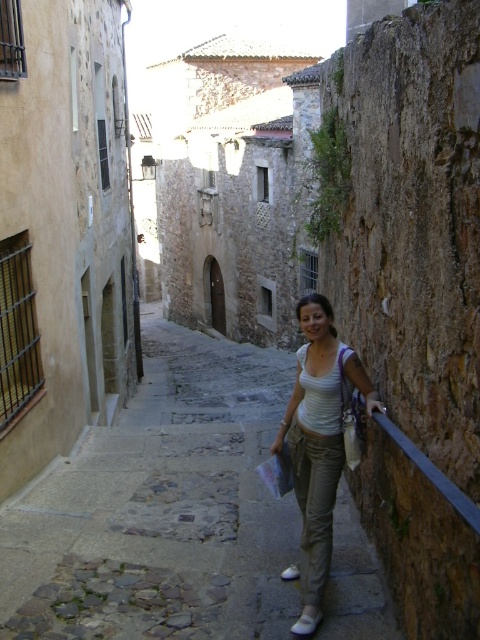
You are a tourist standing at the entrance of the narrow cobblestone street. You see the matte stone stairs at center and the light beige cotton pants at center. Which object takes up more space in the scene?

The matte stone stairs at center is bigger than the light beige cotton pants at center, so it takes up more space in the scene.

You are standing on the cobblestone street looking towards the historic buildings. There are two points marked on the ground in front of you. The first point is at coordinates point (128, 477) and the second point is at point (342, 442). Which point is closer to you?

Point (128, 477) is closer to you because it is further to the viewer than point (342, 442).